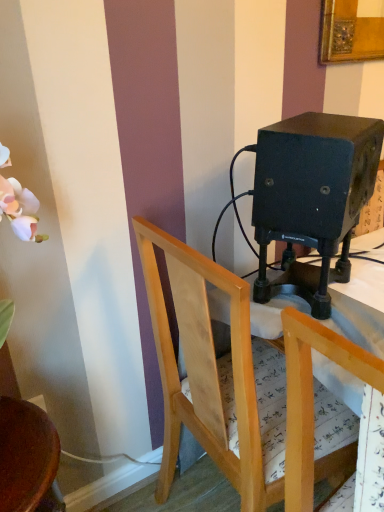
The width and height of the screenshot is (384, 512). I want to click on free spot above wooden chair at lower left, the first chair when ordered from left to right (from a real-world perspective), so click(x=23, y=447).